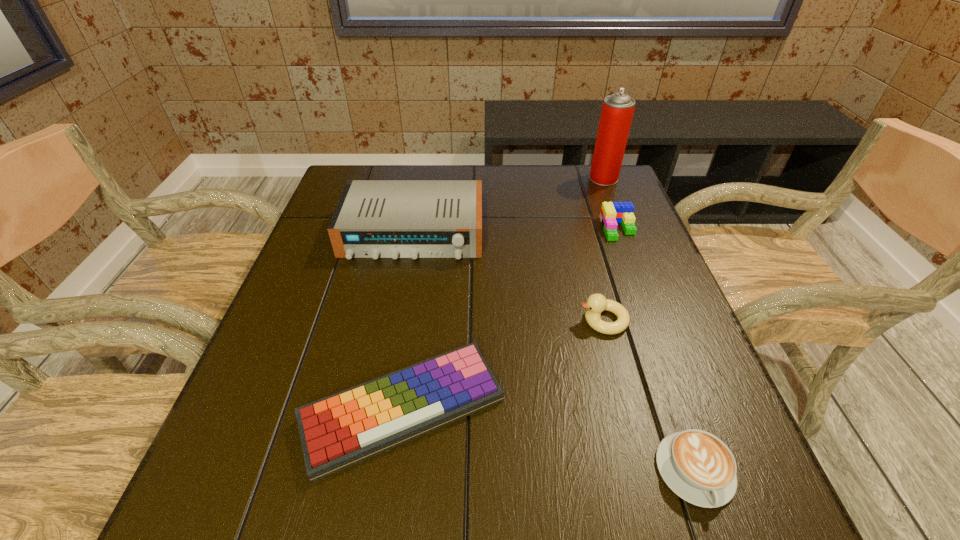
Where is `free space at the near edge`? free space at the near edge is located at coordinates (321, 524).

What are the coordinates of `free space at the left edge` in the screenshot? It's located at (246, 449).

This screenshot has height=540, width=960. What are the coordinates of `free region at the right edge` in the screenshot? It's located at (666, 288).

In order to click on free space that is in between the computer keyboard and the Lego in this screenshot , I will do `click(511, 319)`.

At what (x,y) coordinates should I click in order to perform the action: click on vacant area that lies between the Lego and the cappuccino. Please return your answer as a coordinate pair (x, y). The width and height of the screenshot is (960, 540). Looking at the image, I should click on (657, 350).

What are the coordinates of `vacant point located between the second tallest object and the cappuccino` in the screenshot? It's located at (554, 352).

At what (x,y) coordinates should I click in order to perform the action: click on free space between the cappuccino and the tallest object. Please return your answer as a coordinate pair (x, y). This screenshot has height=540, width=960. Looking at the image, I should click on (649, 325).

Where is `free space between the radio receiver and the Lego`? The width and height of the screenshot is (960, 540). free space between the radio receiver and the Lego is located at coordinates (516, 231).

Locate an element on the screen. free space between the radio receiver and the third nearest object is located at coordinates (508, 276).

You are a GUI agent. You are given a task and a screenshot of the screen. Output one action in this format:
    pyautogui.click(x=<x>, y=<y>)
    Task: Click on the vacant space that is in between the radio receiver and the computer keyboard
    This screenshot has height=540, width=960.
    Given the screenshot: What is the action you would take?
    pyautogui.click(x=408, y=321)